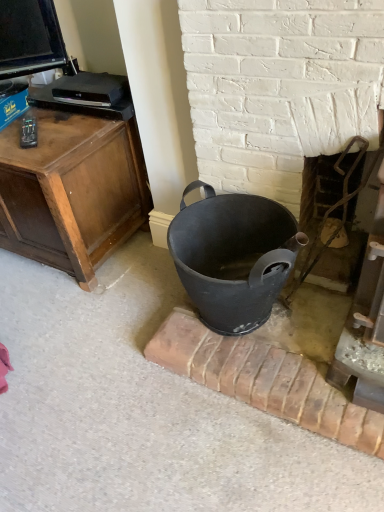
Question: Is rustic metal fireplace at right, acting as the first fireplace starting from the right, wider than matte black trash can at center?

Choices:
 (A) yes
 (B) no

Answer: (B)

Question: Is matte black trash can at center located within rustic metal fireplace at right, acting as the first fireplace starting from the right?

Choices:
 (A) no
 (B) yes

Answer: (A)

Question: Does rustic metal fireplace at right, positioned as the second fireplace in left-to-right order, come behind matte black trash can at center?

Choices:
 (A) no
 (B) yes

Answer: (B)

Question: From a real-world perspective, is rustic metal fireplace at right, positioned as the second fireplace in left-to-right order, beneath matte black trash can at center?

Choices:
 (A) yes
 (B) no

Answer: (B)

Question: Is rustic metal fireplace at right, acting as the first fireplace starting from the right, smaller than matte black trash can at center?

Choices:
 (A) no
 (B) yes

Answer: (B)

Question: In the image, is rustic metal fireplace at right, acting as the first fireplace starting from the right, positioned in front of or behind matte black bucket at center, placed as the 2th fireplace when sorted from right to left?

Choices:
 (A) behind
 (B) front

Answer: (A)

Question: Is rustic metal fireplace at right, acting as the first fireplace starting from the right, bigger or smaller than matte black bucket at center, placed as the 2th fireplace when sorted from right to left?

Choices:
 (A) big
 (B) small

Answer: (B)

Question: From the image's perspective, is rustic metal fireplace at right, positioned as the second fireplace in left-to-right order, located above or below matte black bucket at center, the first fireplace when ordered from left to right?

Choices:
 (A) above
 (B) below

Answer: (B)

Question: Is rustic metal fireplace at right, positioned as the second fireplace in left-to-right order, inside the boundaries of matte black bucket at center, placed as the 2th fireplace when sorted from right to left, or outside?

Choices:
 (A) outside
 (B) inside

Answer: (A)

Question: Considering the positions of rustic metal fireplace at right, acting as the first fireplace starting from the right, and matte black trash can at center in the image, is rustic metal fireplace at right, acting as the first fireplace starting from the right, wider or thinner than matte black trash can at center?

Choices:
 (A) thin
 (B) wide

Answer: (A)

Question: In the image, is rustic metal fireplace at right, positioned as the second fireplace in left-to-right order, positioned in front of or behind matte black trash can at center?

Choices:
 (A) behind
 (B) front

Answer: (A)

Question: Based on their positions, is rustic metal fireplace at right, positioned as the second fireplace in left-to-right order, located to the left or right of matte black trash can at center?

Choices:
 (A) left
 (B) right

Answer: (B)

Question: In terms of size, does rustic metal fireplace at right, positioned as the second fireplace in left-to-right order, appear bigger or smaller than matte black trash can at center?

Choices:
 (A) small
 (B) big

Answer: (A)

Question: Is matte black bucket at center, the first fireplace when ordered from left to right, taller or shorter than rustic metal fireplace at right, positioned as the second fireplace in left-to-right order?

Choices:
 (A) tall
 (B) short

Answer: (A)

Question: Considering the positions of point (291, 111) and point (294, 290), is point (291, 111) closer or farther from the camera than point (294, 290)?

Choices:
 (A) closer
 (B) farther

Answer: (A)